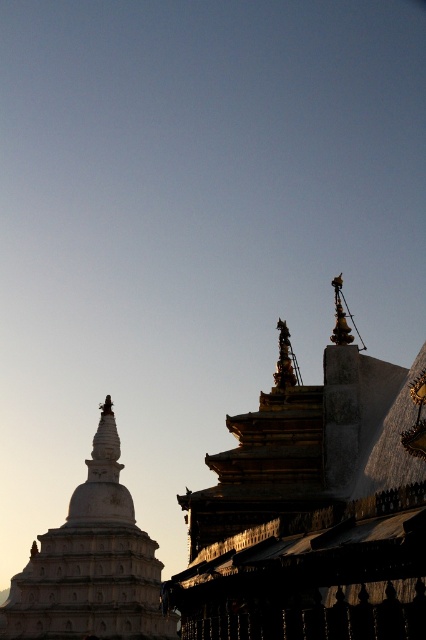
You are standing at the point with coordinates point [313,508] in the image. Describe what you see around you based on the scene description.

You are at the gold gilded stone temple at upper center, which is part of the complex structure on the right side of the image with multiple levels and golden accents, a dark roof, and intricate details. The stupa on the left is visible, showing its tiered design and weathered surface under the clear sky.